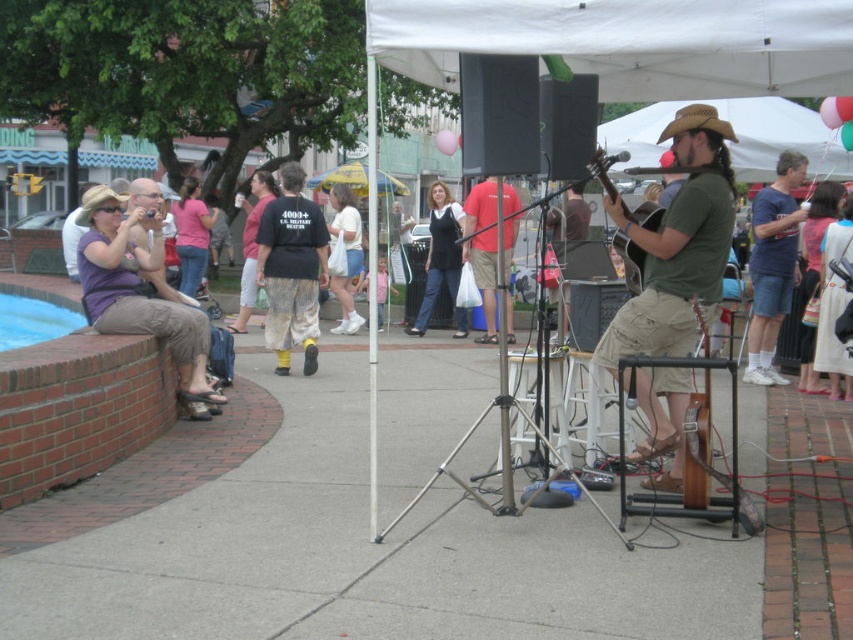
Question: Is gray concrete pavement at center wider than purple fabric shirt at left?

Choices:
 (A) yes
 (B) no

Answer: (A)

Question: Which object appears closest to the camera in this image?

Choices:
 (A) red cotton shirt at center
 (B) gray concrete pavement at center
 (C) acoustic guitar at center
 (D) matte black guitar at center

Answer: (B)

Question: Considering the real-world distances, which object is farthest from the green matte shirt at center?

Choices:
 (A) white cotton dress at lower right
 (B) matte black shirt at center

Answer: (B)

Question: Which object is the closest to the red cotton shirt at center?

Choices:
 (A) black cotton shirt at center
 (B) blue cotton t-shirt at center
 (C) white cotton shirt at center

Answer: (C)

Question: From the image, what is the correct spatial relationship of red cotton shirt at center in relation to white cotton shirt at center?

Choices:
 (A) below
 (B) above

Answer: (A)

Question: Does green matte shirt at center appear on the right side of red cotton shirt at center?

Choices:
 (A) no
 (B) yes

Answer: (B)